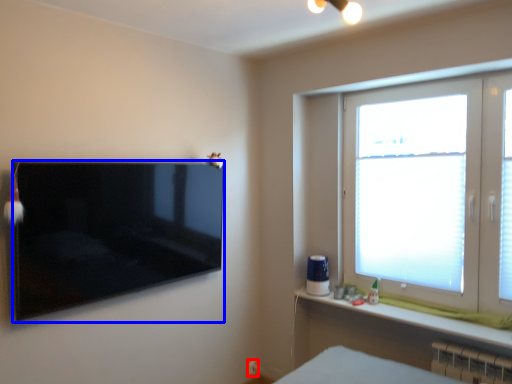
Question: Among these objects, which one is farthest to the camera, electric outlet (highlighted by a red box) or television (highlighted by a blue box)?

Choices:
 (A) electric outlet
 (B) television

Answer: (A)